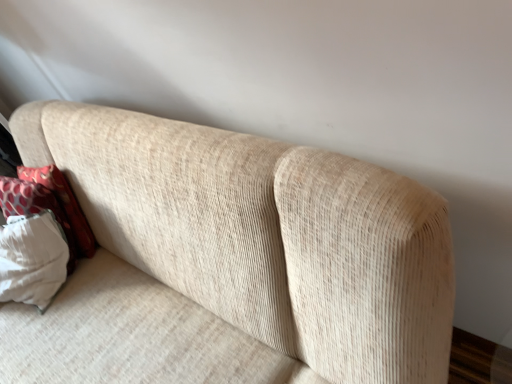
The height and width of the screenshot is (384, 512). Describe the element at coordinates (49, 206) in the screenshot. I see `white textured pillow at left` at that location.

Measure the distance between point (16, 190) and camera.

1.63 meters.

This screenshot has width=512, height=384. I want to click on white textured pillow at left, so pos(49,206).

From the picture: Measure the distance between beige corduroy couch at upper center and camera.

A distance of 27.91 inches exists between beige corduroy couch at upper center and camera.

What do you see at coordinates (232, 261) in the screenshot? I see `beige corduroy couch at upper center` at bounding box center [232, 261].

Locate an element on the screen. beige corduroy couch at upper center is located at coordinates (232, 261).

Locate an element on the screen. Image resolution: width=512 pixels, height=384 pixels. white textured pillow at left is located at coordinates (49, 206).

Considering the positions of objects beige corduroy couch at upper center and white textured pillow at left in the image provided, who is more to the left, beige corduroy couch at upper center or white textured pillow at left?

Positioned to the left is white textured pillow at left.

Is beige corduroy couch at upper center closer to the viewer compared to white textured pillow at left?

Yes, beige corduroy couch at upper center is in front of white textured pillow at left.

Considering the points (119, 264) and (52, 210), which point is behind, point (119, 264) or point (52, 210)?

The point (52, 210) is behind.

From the image's perspective, is beige corduroy couch at upper center above white textured pillow at left?

Incorrect, from the image's perspective, beige corduroy couch at upper center is lower than white textured pillow at left.

From a real-world perspective, who is located lower, beige corduroy couch at upper center or white textured pillow at left?

In real-world perspective, beige corduroy couch at upper center is lower.

Considering the sizes of beige corduroy couch at upper center and white textured pillow at left in the image, is beige corduroy couch at upper center wider or thinner than white textured pillow at left?

Clearly, beige corduroy couch at upper center has more width compared to white textured pillow at left.

Consider the image. Which of these two, beige corduroy couch at upper center or white textured pillow at left, stands taller?

With more height is beige corduroy couch at upper center.

Is beige corduroy couch at upper center bigger or smaller than white textured pillow at left?

Considering their sizes, beige corduroy couch at upper center takes up more space than white textured pillow at left.

Is white textured pillow at left inside beige corduroy couch at upper center?

Yes, beige corduroy couch at upper center is surrounding white textured pillow at left.

Can you see beige corduroy couch at upper center touching white textured pillow at left?

beige corduroy couch at upper center and white textured pillow at left are clearly separated.

Could you tell me if beige corduroy couch at upper center is turned towards white textured pillow at left?

Yes, beige corduroy couch at upper center is turned towards white textured pillow at left.

How different are the orientations of beige corduroy couch at upper center and white textured pillow at left in degrees?

1.55 degrees.

How much distance is there between beige corduroy couch at upper center and white textured pillow at left?

beige corduroy couch at upper center is 47.10 centimeters from white textured pillow at left.

This screenshot has height=384, width=512. Identify the location of pillow above the beige corduroy couch at upper center (from a real-world perspective). (49, 206).

In the image, is white textured pillow at left on the left side or the right side of beige corduroy couch at upper center?

white textured pillow at left is to the left of beige corduroy couch at upper center.

Is the position of white textured pillow at left less distant than that of beige corduroy couch at upper center?

No.

Is point (31, 204) positioned in front of point (258, 203)?

No.

From the image's perspective, which one is positioned lower, white textured pillow at left or beige corduroy couch at upper center?

From the image's view, beige corduroy couch at upper center is below.

From a real-world perspective, is white textured pillow at left positioned under beige corduroy couch at upper center based on gravity?

No, from a real-world perspective, white textured pillow at left is not below beige corduroy couch at upper center.

In terms of width, does white textured pillow at left look wider or thinner when compared to beige corduroy couch at upper center?

white textured pillow at left is thinner than beige corduroy couch at upper center.

Looking at this image, is white textured pillow at left taller or shorter than beige corduroy couch at upper center?

white textured pillow at left is shorter than beige corduroy couch at upper center.

Which of these two, white textured pillow at left or beige corduroy couch at upper center, is bigger?

beige corduroy couch at upper center is bigger.

Can beige corduroy couch at upper center be found inside white textured pillow at left?

That's incorrect, beige corduroy couch at upper center is not inside white textured pillow at left.

Is white textured pillow at left in contact with beige corduroy couch at upper center?

No, white textured pillow at left is not with beige corduroy couch at upper center.

Based on the photo, is white textured pillow at left facing away from beige corduroy couch at upper center?

Yes, white textured pillow at left's orientation is away from beige corduroy couch at upper center.

This screenshot has width=512, height=384. I want to click on pillow above the beige corduroy couch at upper center (from a real-world perspective), so click(49, 206).

Where is `studio couch that appears in front of the white textured pillow at left`? The image size is (512, 384). studio couch that appears in front of the white textured pillow at left is located at coordinates (232, 261).

This screenshot has height=384, width=512. Find the location of `pillow above the beige corduroy couch at upper center (from the image's perspective)`. pillow above the beige corduroy couch at upper center (from the image's perspective) is located at coordinates (49, 206).